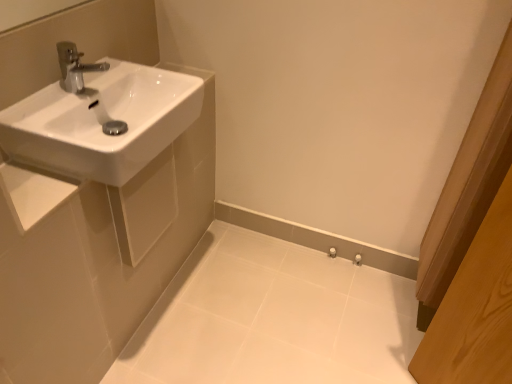
The height and width of the screenshot is (384, 512). Describe the element at coordinates (101, 122) in the screenshot. I see `white glossy sink at upper left` at that location.

The image size is (512, 384). Describe the element at coordinates (273, 318) in the screenshot. I see `white glossy porcelain at lower center` at that location.

You are a GUI agent. You are given a task and a screenshot of the screen. Output one action in this format:
    pyautogui.click(x=<x>, y=<y>)
    Task: Click on the white glossy sink at left
    The width and height of the screenshot is (512, 384).
    Given the screenshot: What is the action you would take?
    pyautogui.click(x=146, y=207)

Is white glossy sink at left completely or partially inside white glossy sink at upper left?

No, white glossy sink at left is not a part of white glossy sink at upper left.

The height and width of the screenshot is (384, 512). I want to click on square located underneath the white glossy sink at upper left (from a real-world perspective), so click(x=146, y=207).

Considering the relative sizes of white glossy porcelain at lower center and white glossy sink at upper left in the image provided, is white glossy porcelain at lower center thinner than white glossy sink at upper left?

Incorrect, the width of white glossy porcelain at lower center is not less than that of white glossy sink at upper left.

In the image, is white glossy porcelain at lower center positioned in front of or behind white glossy sink at upper left?

white glossy porcelain at lower center is positioned farther from the viewer than white glossy sink at upper left.

From a real-world perspective, is white glossy porcelain at lower center over white glossy sink at upper left?

No, from a real-world perspective, white glossy porcelain at lower center is not over white glossy sink at upper left

Is white glossy porcelain at lower center aimed at white glossy sink at upper left?

No, white glossy porcelain at lower center is not facing towards white glossy sink at upper left.

Would you consider white glossy sink at left to be distant from white glossy porcelain at lower center?

Actually, white glossy sink at left and white glossy porcelain at lower center are a little close together.

Is white glossy sink at left facing towards white glossy porcelain at lower center?

No, white glossy sink at left is not turned towards white glossy porcelain at lower center.

In the image, is white glossy sink at left on the left side or the right side of white glossy porcelain at lower center?

In the image, white glossy sink at left appears on the left side of white glossy porcelain at lower center.

Where is `square above the white glossy porcelain at lower center (from a real-world perspective)`? Image resolution: width=512 pixels, height=384 pixels. square above the white glossy porcelain at lower center (from a real-world perspective) is located at coordinates (146, 207).

Considering the sizes of objects white glossy sink at left and white glossy sink at upper left in the image provided, who is taller, white glossy sink at left or white glossy sink at upper left?

With more height is white glossy sink at left.

There is a white glossy sink at left. Where is `sink above it (from a real-world perspective)`? sink above it (from a real-world perspective) is located at coordinates (101, 122).

Is point (170, 187) behind point (20, 127)?

Yes, it is.

From the image's perspective, is white glossy porcelain at lower center located above or below white glossy sink at left?

Based on their image positions, white glossy porcelain at lower center is located beneath white glossy sink at left.

Who is taller, white glossy porcelain at lower center or white glossy sink at left?

white glossy sink at left.

The width and height of the screenshot is (512, 384). What are the coordinates of `square located above the white glossy porcelain at lower center (from a real-world perspective)` in the screenshot? It's located at (146, 207).

What's the angular difference between white glossy porcelain at lower center and white glossy sink at left's facing directions?

1.74 degrees.

Is white glossy sink at upper left shorter than white glossy porcelain at lower center?

No.

Is white glossy sink at upper left bigger or smaller than white glossy porcelain at lower center?

In the image, white glossy sink at upper left appears to be larger than white glossy porcelain at lower center.

Between white glossy sink at upper left and white glossy porcelain at lower center, which one is positioned in front?

white glossy sink at upper left is more forward.

I want to click on sink above the white glossy sink at left (from a real-world perspective), so click(101, 122).

Find the location of a particular element. The height and width of the screenshot is (384, 512). sink that appears above the white glossy porcelain at lower center (from the image's perspective) is located at coordinates (101, 122).

Considering their positions, is white glossy porcelain at lower center positioned further to white glossy sink at left than white glossy sink at upper left?

white glossy porcelain at lower center is positioned further to the anchor white glossy sink at left.

Estimate the real-world distances between objects in this image. Which object is further from white glossy porcelain at lower center, white glossy sink at left or white glossy sink at upper left?

white glossy sink at upper left is positioned further to the anchor white glossy porcelain at lower center.

Estimate the real-world distances between objects in this image. Which object is closer to white glossy sink at upper left, white glossy sink at left or white glossy porcelain at lower center?

The object closer to white glossy sink at upper left is white glossy sink at left.

Estimate the real-world distances between objects in this image. Which object is further from white glossy porcelain at lower center, white glossy sink at upper left or white glossy sink at left?

white glossy sink at upper left is positioned further to the anchor white glossy porcelain at lower center.

Based on their spatial positions, is white glossy porcelain at lower center or white glossy sink at left closer to white glossy sink at upper left?

white glossy sink at left is positioned closer to the anchor white glossy sink at upper left.

Based on their spatial positions, is white glossy sink at upper left or white glossy porcelain at lower center closer to white glossy sink at left?

white glossy sink at upper left lies closer to white glossy sink at left than the other object.

Identify the location of square between white glossy sink at upper left and white glossy porcelain at lower center vertically. (146, 207).